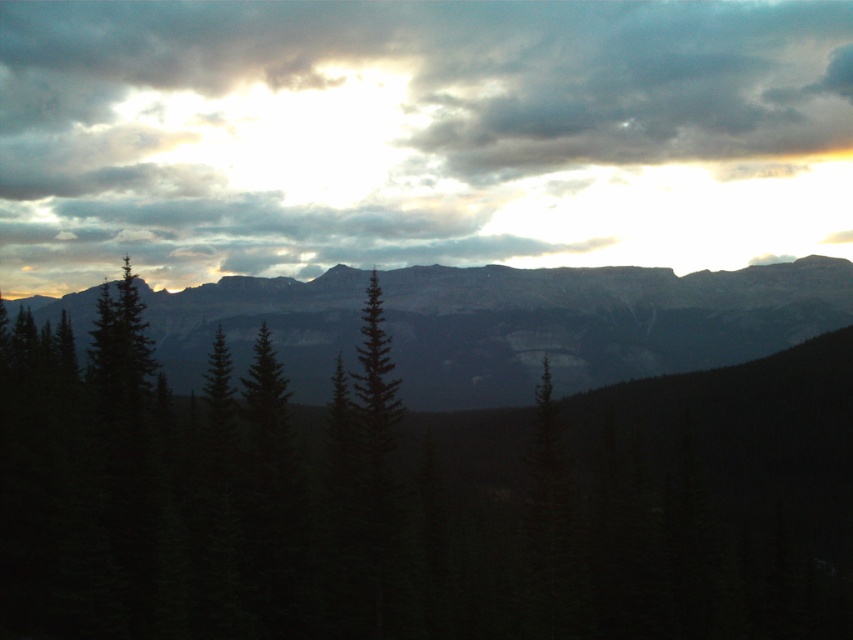
Question: Does dark green pine at center lie in front of cloudy sky at upper center?

Choices:
 (A) no
 (B) yes

Answer: (B)

Question: Which point is farther to the camera?

Choices:
 (A) (137, 544)
 (B) (851, 198)

Answer: (B)

Question: Does dark green pine at center appear under dark gray rocky mountain range at center?

Choices:
 (A) yes
 (B) no

Answer: (B)

Question: Which point is closer to the camera?

Choices:
 (A) [x=45, y=499]
 (B) [x=596, y=118]
 (C) [x=170, y=340]

Answer: (A)

Question: Which point is closer to the camera taking this photo?

Choices:
 (A) (47, 371)
 (B) (607, 276)

Answer: (A)

Question: Is dark green pine at center above cloudy sky at upper center?

Choices:
 (A) yes
 (B) no

Answer: (B)